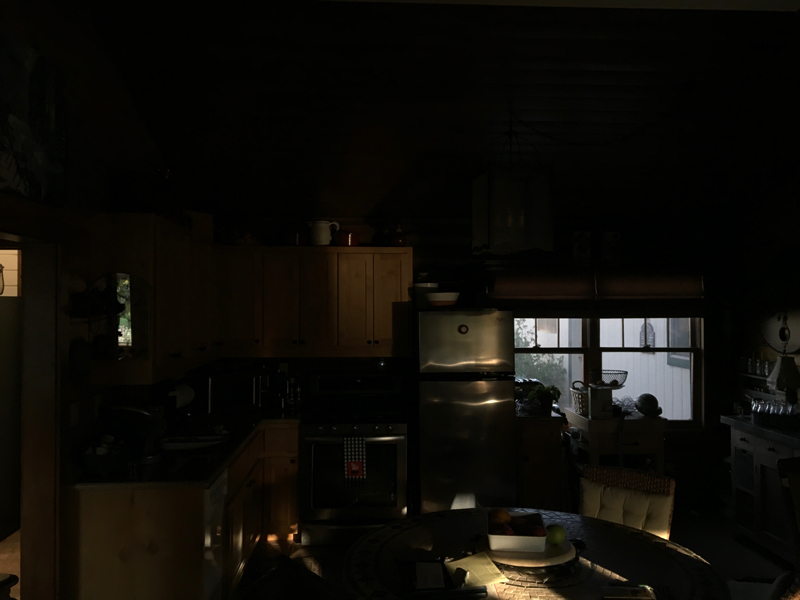
I want to click on white pitcher, so click(324, 230).